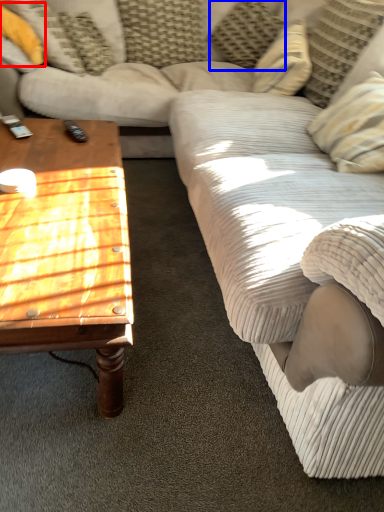
Question: Among these objects, which one is nearest to the camera, pillow (highlighted by a red box) or pillow (highlighted by a blue box)?

Choices:
 (A) pillow
 (B) pillow

Answer: (A)